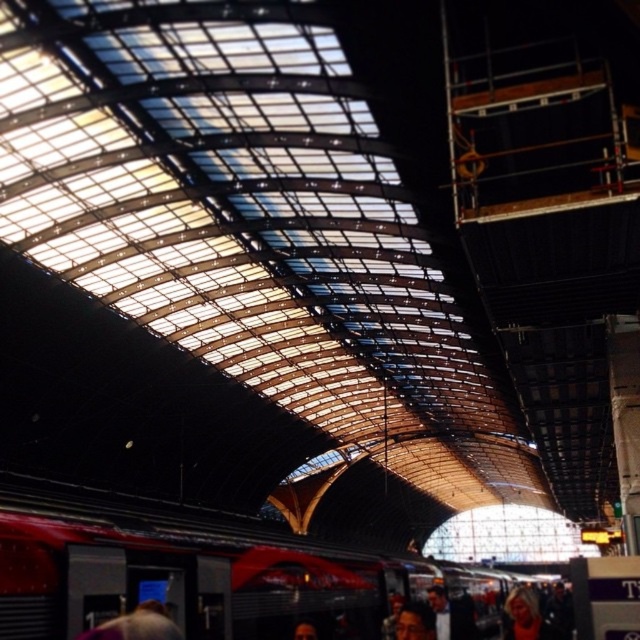
Question: Considering the real-world distances, which object is closest to the blonde hair at lower right?

Choices:
 (A) smooth brown hair at lower center
 (B) red metallic train at center

Answer: (B)

Question: Does red metallic train at center appear under smooth brown hair at lower center?

Choices:
 (A) no
 (B) yes

Answer: (B)

Question: Among these points, which one is farthest from the camera?

Choices:
 (A) (513, 632)
 (B) (84, 600)
 (C) (412, 634)

Answer: (A)

Question: Does blonde hair at lower right appear on the right side of smooth brown hair at lower center?

Choices:
 (A) no
 (B) yes

Answer: (B)

Question: Does red metallic train at center lie behind smooth brown hair at lower center?

Choices:
 (A) no
 (B) yes

Answer: (A)

Question: Considering the real-world distances, which object is farthest from the red metallic train at center?

Choices:
 (A) smooth brown hair at lower center
 (B) blonde hair at lower right

Answer: (B)